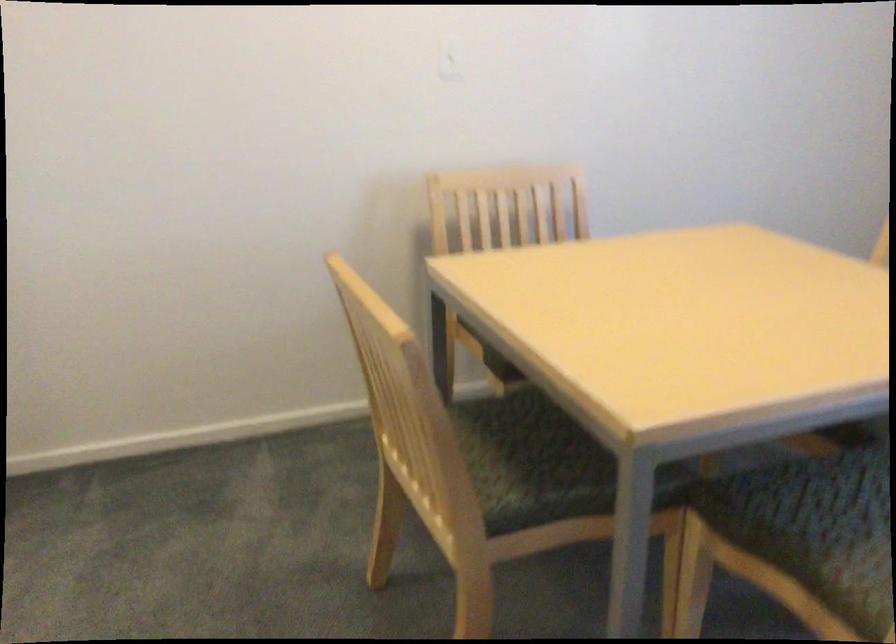
Find the location of a particular element. The width and height of the screenshot is (896, 644). white light switch is located at coordinates point(449,61).